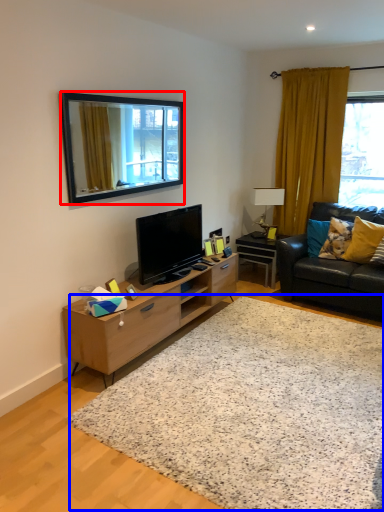
Question: Which of the following is the farthest to the observer, mirror (highlighted by a red box) or plain (highlighted by a blue box)?

Choices:
 (A) mirror
 (B) plain

Answer: (A)